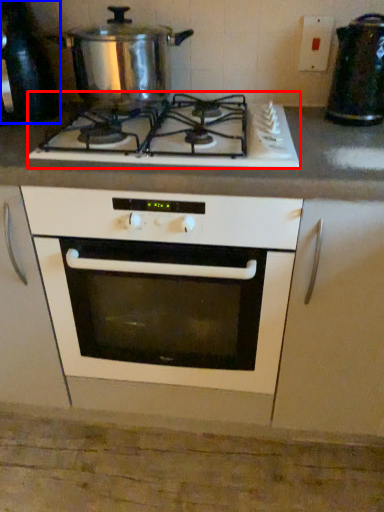
Question: Which of the following is the closest to the observer, gas stove (highlighted by a red box) or appliance (highlighted by a blue box)?

Choices:
 (A) gas stove
 (B) appliance

Answer: (A)